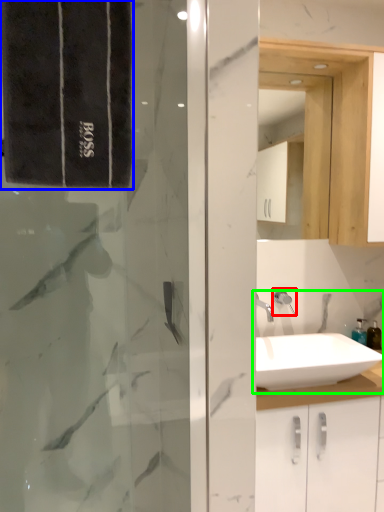
Question: Considering the real-world distances, which object is closest to shower (highlighted by a red box)? bath towel (highlighted by a blue box) or sink (highlighted by a green box).

Choices:
 (A) bath towel
 (B) sink

Answer: (B)